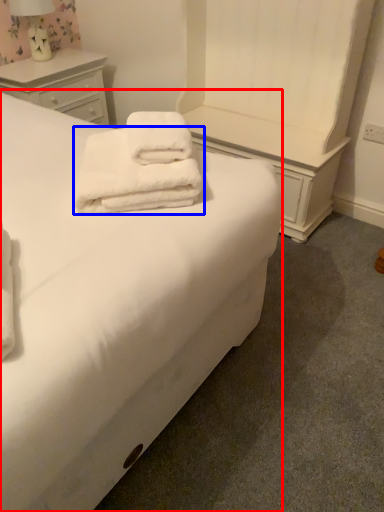
Question: Which object is closer to the camera taking this photo, bed (highlighted by a red box) or towel (highlighted by a blue box)?

Choices:
 (A) bed
 (B) towel

Answer: (A)